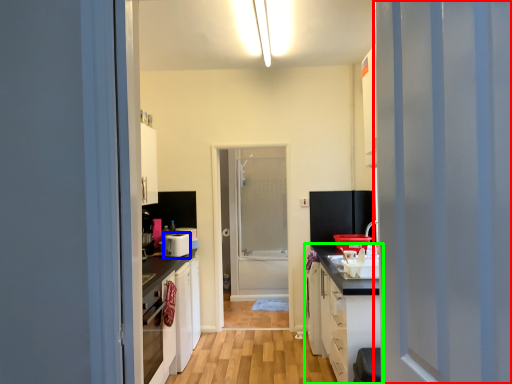
Question: Considering the real-world distances, which object is farthest from door (highlighted by a red box)? appliance (highlighted by a blue box) or cabinetry (highlighted by a green box)?

Choices:
 (A) appliance
 (B) cabinetry

Answer: (A)